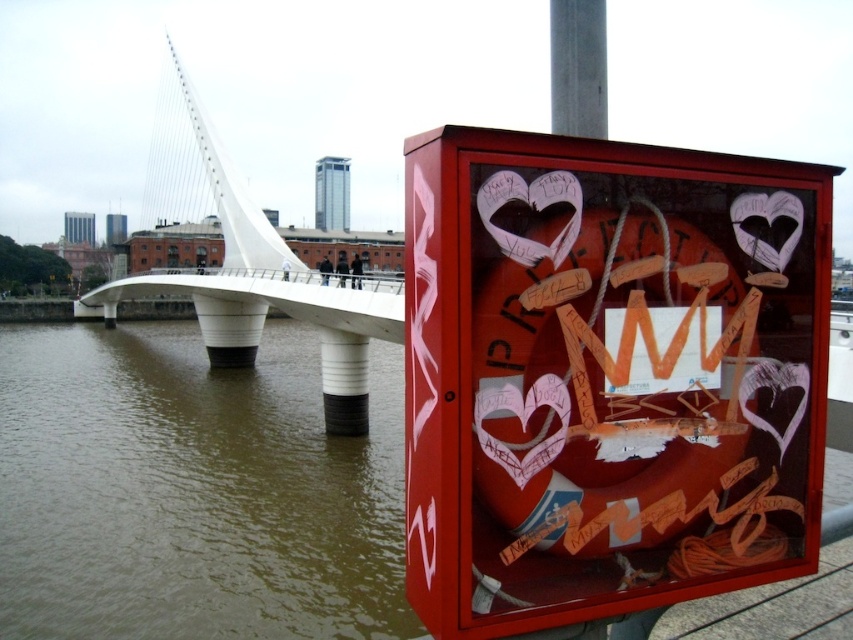
You are standing in front of the red box and want to take a photo. There are two points marked in the image, point A at coordinates point (525, 337) and point B at coordinates point (332, 385). Which point should you focus on to ensure the red box is in sharp focus?

You should focus on point A at coordinates point (525, 337) because it is closer to the camera than point B at coordinates point (332, 385), ensuring the red box remains in focus.

You are a delivery drone with a maximum flight distance of 30 meters. You need to deliver a package from the shiny red box at center to the white matte bridge at upper center. Can you complete this delivery without recharging?

The distance between the shiny red box at center and the white matte bridge at upper center is 32.14 meters, which exceeds the drone s maximum flight distance of 30 meters. Therefore, the drone cannot complete the delivery without recharging.

You are a city planner reviewing this urban area. You notice the brown murky water at lower left and the white matte bridge at upper center. Based on their positions, which object is closer to the ground level?

The brown murky water at lower left is closer to the ground level because it is positioned below the white matte bridge at upper center.